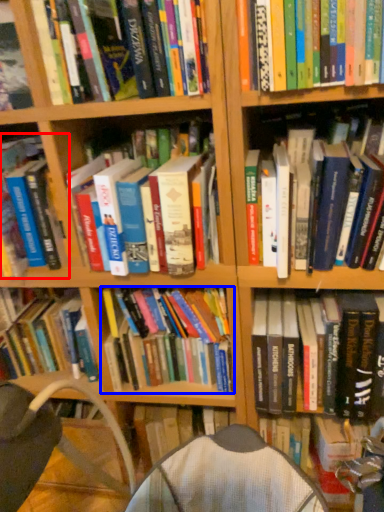
Question: Which object is further to the camera taking this photo, book (highlighted by a red box) or book (highlighted by a blue box)?

Choices:
 (A) book
 (B) book

Answer: (B)